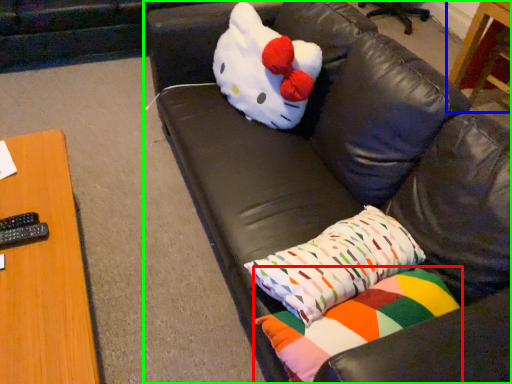
Question: Estimate the real-world distances between objects in this image. Which object is farther from pillow (highlighted by a red box), table (highlighted by a blue box) or studio couch (highlighted by a green box)?

Choices:
 (A) table
 (B) studio couch

Answer: (A)